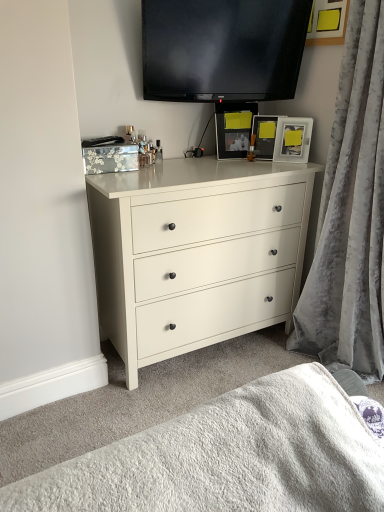
Locate an element on the screen. blank area to the left of matte silver picture frame at upper right, the second picture frame from the left is located at coordinates (258, 161).